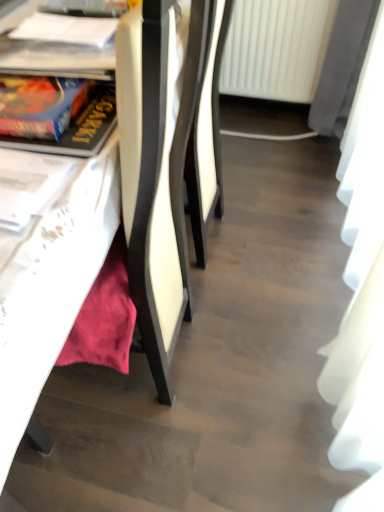
At what (x,y) coordinates should I click in order to perform the action: click on white plastic radiator at upper center. Please return your answer as a coordinate pair (x, y). This screenshot has height=512, width=384. Looking at the image, I should click on click(x=276, y=48).

The width and height of the screenshot is (384, 512). Identify the location of matte white table at lower left. (66, 254).

Locate an element on the screen. white fabric curtain at right is located at coordinates (361, 293).

Image resolution: width=384 pixels, height=512 pixels. I want to click on blue cardboard book at left, positioned as the second book in top-to-bottom order, so click(77, 125).

Is blue cardboard book at left, which is counted as the 1th book, starting from the bottom, positioned behind white paper at upper left, placed as the 2th book when sorted from bottom to top?

No, it is not.

Can white paper at upper left, which is the 2th book from front to back, be found inside blue cardboard book at left, the second book positioned from the back?

That's incorrect, white paper at upper left, which is the 2th book from front to back, is not inside blue cardboard book at left, the second book positioned from the back.

This screenshot has width=384, height=512. Find the location of `book that is on the right side of blue cardboard book at left, arranged as the first book when viewed from the front`. book that is on the right side of blue cardboard book at left, arranged as the first book when viewed from the front is located at coordinates (66, 29).

Is matte white table at lower left located outside white paper at upper left, which ranks as the 1th book in top-to-bottom order?

Indeed, matte white table at lower left is completely outside white paper at upper left, which ranks as the 1th book in top-to-bottom order.

Consider the image. Which object is positioned more to the left, matte white table at lower left or white paper at upper left, which is the 2th book from front to back?

matte white table at lower left.

Locate an element on the screen. the 2nd book behind the matte white table at lower left is located at coordinates (66, 29).

Considering the relative sizes of matte white table at lower left and white paper at upper left, which ranks as the 1th book in top-to-bottom order, in the image provided, is matte white table at lower left shorter than white paper at upper left, which ranks as the 1th book in top-to-bottom order,?

Incorrect, the height of matte white table at lower left does not fall short of that of white paper at upper left, which ranks as the 1th book in top-to-bottom order.

Is point (371, 57) farther from camera compared to point (313, 25)?

No, (371, 57) is in front of (313, 25).

Is white fabric curtain at right spatially inside white plastic radiator at upper center, or outside of it?

white fabric curtain at right is outside white plastic radiator at upper center.

Based on the photo, from the image's perspective, is white fabric curtain at right located above white plastic radiator at upper center?

No, from the image's perspective, white fabric curtain at right is not over white plastic radiator at upper center.

Visually, is white fabric curtain at right positioned to the left or to the right of white plastic radiator at upper center?

white fabric curtain at right is positioned on white plastic radiator at upper center's right side.

What's the angular difference between matte white table at lower left and blue cardboard book at left, positioned as the second book in top-to-bottom order,'s facing directions?

matte white table at lower left and blue cardboard book at left, positioned as the second book in top-to-bottom order, are facing 1.54 degrees away from each other.

Is matte white table at lower left facing towards blue cardboard book at left, which is counted as the 1th book, starting from the bottom?

No, matte white table at lower left is not oriented towards blue cardboard book at left, which is counted as the 1th book, starting from the bottom.

Image resolution: width=384 pixels, height=512 pixels. Find the location of `table beneath the blue cardboard book at left, which is counted as the 1th book, starting from the bottom (from a real-world perspective)`. table beneath the blue cardboard book at left, which is counted as the 1th book, starting from the bottom (from a real-world perspective) is located at coordinates (66, 254).

Who is taller, matte white table at lower left or blue cardboard book at left, the second book positioned from the back?

With more height is matte white table at lower left.

Looking at this image, are white plastic radiator at upper center and white fabric curtain at right making contact?

No, white plastic radiator at upper center is not next to white fabric curtain at right.

How far apart are white plastic radiator at upper center and white fabric curtain at right?

A distance of 64.19 centimeters exists between white plastic radiator at upper center and white fabric curtain at right.

How many degrees apart are the facing directions of white plastic radiator at upper center and white fabric curtain at right?

The facing directions of white plastic radiator at upper center and white fabric curtain at right are 91.5 degrees apart.

Considering the relative sizes of white plastic radiator at upper center and white fabric curtain at right in the image provided, is white plastic radiator at upper center smaller than white fabric curtain at right?

Correct, white plastic radiator at upper center occupies less space than white fabric curtain at right.

In the scene shown: Is matte white table at lower left not near white plastic radiator at upper center?

matte white table at lower left is positioned a significant distance from white plastic radiator at upper center.

Considering the positions of points (34, 347) and (250, 5), is point (34, 347) closer to camera compared to point (250, 5)?

That is True.

From the image's perspective, is matte white table at lower left beneath white plastic radiator at upper center?

Indeed, from the image's perspective, matte white table at lower left is shown beneath white plastic radiator at upper center.

From a real-world perspective, is matte white table at lower left positioned above or below white plastic radiator at upper center?

matte white table at lower left is situated higher than white plastic radiator at upper center in the real world.

Are white paper at upper left, which is the 2th book from front to back, and white fabric curtain at right far apart?

white paper at upper left, which is the 2th book from front to back, is far away from white fabric curtain at right.

Identify the location of book that is the 1st object to the left of the white fabric curtain at right, starting at the anchor. (66, 29).

Considering the positions of point (77, 26) and point (343, 159), is point (77, 26) closer or farther from the camera than point (343, 159)?

Point (77, 26).

Is white paper at upper left, which ranks as the 1th book in top-to-bottom order, looking in the opposite direction of white fabric curtain at right?

Absolutely, white paper at upper left, which ranks as the 1th book in top-to-bottom order, is directed away from white fabric curtain at right.

You are a GUI agent. You are given a task and a screenshot of the screen. Output one action in this format:
    pyautogui.click(x=<x>, y=<y>)
    Task: Click on the book on the right of the blue cardboard book at left, the second book positioned from the back
    
    Given the screenshot: What is the action you would take?
    pyautogui.click(x=66, y=29)

Identify the location of book that is the 2nd one when counting backward from the matte white table at lower left. (66, 29).

Looking at the image, which one is located closer to white fabric curtain at right, blue cardboard book at left, arranged as the first book when viewed from the front, or white paper at upper left, which ranks as the 1th book in top-to-bottom order?

blue cardboard book at left, arranged as the first book when viewed from the front, is positioned closer to the anchor white fabric curtain at right.

When comparing their distances from white plastic radiator at upper center, does white paper at upper left, placed as the 2th book when sorted from bottom to top, or white fabric curtain at right seem closer?

white fabric curtain at right lies closer to white plastic radiator at upper center than the other object.

Which object lies further to the anchor point white paper at upper left, which is the 2th book from front to back, matte white table at lower left or blue cardboard book at left, positioned as the second book in top-to-bottom order?

matte white table at lower left.

Based on the photo, which object lies further to the anchor point white paper at upper left, placed as the 2th book when sorted from bottom to top, blue cardboard book at left, the second book positioned from the back, or white plastic radiator at upper center?

white plastic radiator at upper center is further to white paper at upper left, placed as the 2th book when sorted from bottom to top.

Based on their spatial positions, is matte white table at lower left or white paper at upper left, which is the 2th book from front to back, further from blue cardboard book at left, positioned as the second book in top-to-bottom order?

Based on the image, white paper at upper left, which is the 2th book from front to back, appears to be further to blue cardboard book at left, positioned as the second book in top-to-bottom order.

Which object lies nearer to the anchor point white fabric curtain at right, white plastic radiator at upper center or blue cardboard book at left, arranged as the first book when viewed from the front?

white plastic radiator at upper center.

Which object lies further to the anchor point white plastic radiator at upper center, white fabric curtain at right or blue cardboard book at left, arranged as the first book when viewed from the front?

blue cardboard book at left, arranged as the first book when viewed from the front, is positioned further to the anchor white plastic radiator at upper center.

From the image, which object appears to be farther from white plastic radiator at upper center, matte white table at lower left or white fabric curtain at right?

matte white table at lower left.

This screenshot has height=512, width=384. What are the coordinates of `book situated between blue cardboard book at left, positioned as the second book in top-to-bottom order, and white fabric curtain at right from left to right` in the screenshot? It's located at (66, 29).

Identify the location of curtain between matte white table at lower left and white plastic radiator at upper center in the front-back direction. The width and height of the screenshot is (384, 512). (361, 293).

Locate an element on the screen. This screenshot has height=512, width=384. book located between blue cardboard book at left, arranged as the first book when viewed from the front, and white plastic radiator at upper center in the depth direction is located at coordinates (66, 29).

This screenshot has height=512, width=384. I want to click on book located between matte white table at lower left and white paper at upper left, placed as the 2th book when sorted from bottom to top, in the depth direction, so click(77, 125).